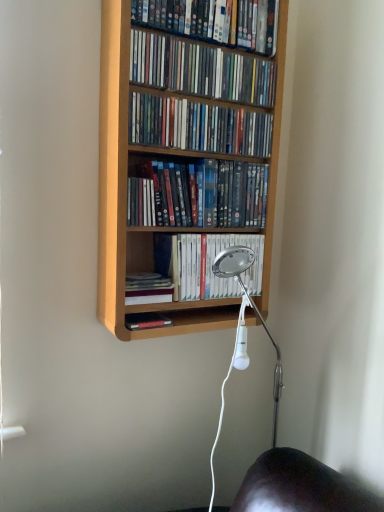
You are a GUI agent. You are given a task and a screenshot of the screen. Output one action in this format:
    pyautogui.click(x=<x>, y=<y>)
    Task: Click on the free spot above matte plastic dvds at center, the 3th book from the bottom (from a real-world perspective)
    
    Given the screenshot: What is the action you would take?
    pyautogui.click(x=200, y=155)